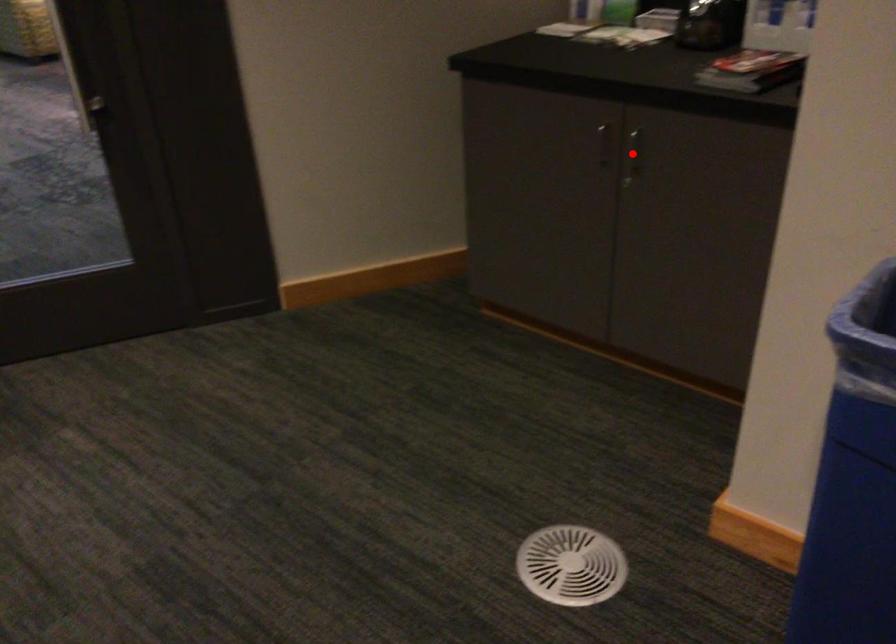
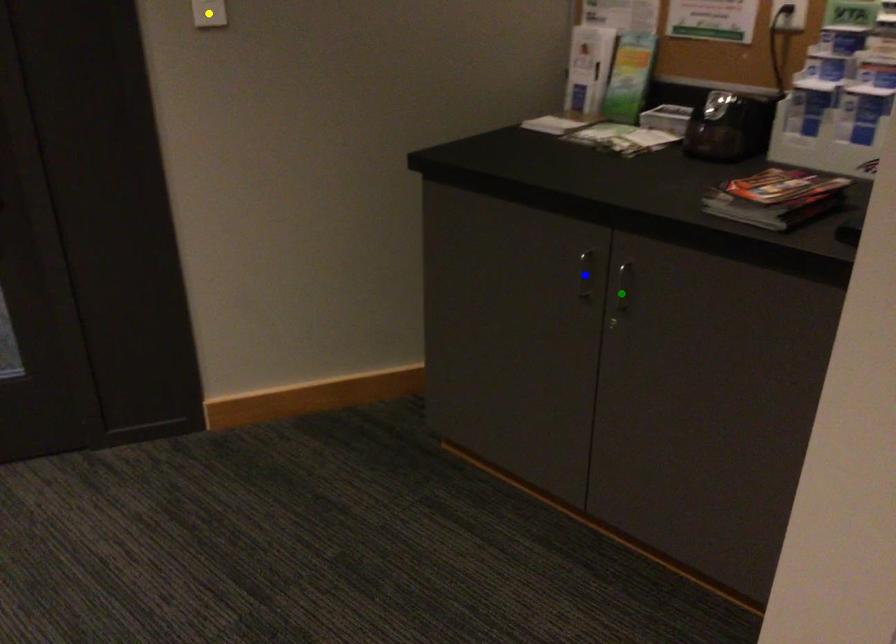
Question: I am providing you with two images of the same scene from different viewpoints. A red point is marked on the first image. You are given multiple points on the second image. Can you choose the point in image 2 that corresponds to the point in image 1?

Choices:
 (A) yellow point
 (B) blue point
 (C) green point

Answer: (C)